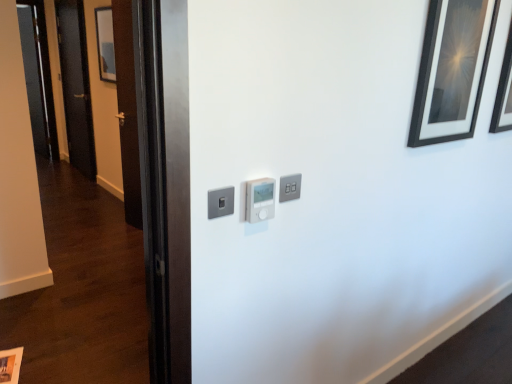
Question: Should I look upward or downward to see satin silver switch at center, which is the 1th light switch in left-to-right order?

Choices:
 (A) down
 (B) up

Answer: (A)

Question: Is black glossy picture frame at upper right, arranged as the first picture frame when viewed from the right, a part of transparent glass door at left?

Choices:
 (A) no
 (B) yes

Answer: (A)

Question: Does transparent glass door at left touch black glossy picture frame at upper right, acting as the 2th picture frame starting from the front?

Choices:
 (A) yes
 (B) no

Answer: (B)

Question: Could you tell me if transparent glass door at left is facing black glossy picture frame at upper right, acting as the third picture frame starting from the bottom?

Choices:
 (A) no
 (B) yes

Answer: (A)

Question: Can you confirm if transparent glass door at left is taller than black glossy picture frame at upper right, the fourth picture frame from the left?

Choices:
 (A) yes
 (B) no

Answer: (A)

Question: Considering the relative sizes of transparent glass door at left and black glossy picture frame at upper right, which is the second picture frame from top to bottom, in the image provided, is transparent glass door at left thinner than black glossy picture frame at upper right, which is the second picture frame from top to bottom,?

Choices:
 (A) no
 (B) yes

Answer: (B)

Question: Can you confirm if transparent glass door at left is wider than black glossy picture frame at upper right, the fourth picture frame from the left?

Choices:
 (A) yes
 (B) no

Answer: (B)

Question: Is satin silver light switch at upper center, the first light switch positioned from the right, completely or partially inside transparent glass door at left?

Choices:
 (A) no
 (B) yes

Answer: (A)

Question: Is transparent glass door at left further to camera compared to satin silver light switch at upper center, which is the third light switch in left-to-right order?

Choices:
 (A) no
 (B) yes

Answer: (B)

Question: Can you confirm if transparent glass door at left is shorter than satin silver light switch at upper center, the first light switch positioned from the right?

Choices:
 (A) no
 (B) yes

Answer: (A)

Question: From the image's perspective, is transparent glass door at left located above satin silver light switch at upper center, which is the third light switch in left-to-right order?

Choices:
 (A) no
 (B) yes

Answer: (B)

Question: Is transparent glass door at left with satin silver light switch at upper center, which is the third light switch in left-to-right order?

Choices:
 (A) yes
 (B) no

Answer: (B)

Question: Is transparent glass door at left in front of satin silver light switch at upper center, the first light switch positioned from the right?

Choices:
 (A) yes
 (B) no

Answer: (B)

Question: Considering the relative sizes of white plastic thermostat at center, the 2th light switch from the left, and transparent glass door at left in the image provided, is white plastic thermostat at center, the 2th light switch from the left, smaller than transparent glass door at left?

Choices:
 (A) yes
 (B) no

Answer: (A)